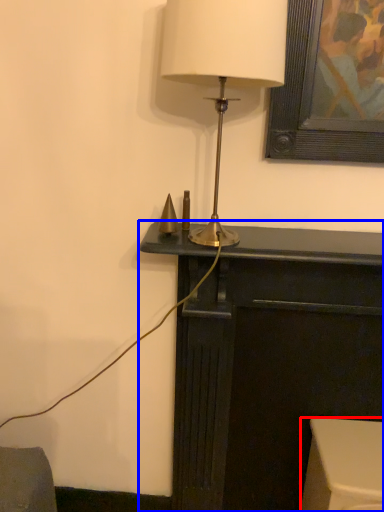
Question: Which of the following is the farthest to the observer, furniture (highlighted by a red box) or furniture (highlighted by a blue box)?

Choices:
 (A) furniture
 (B) furniture

Answer: (A)